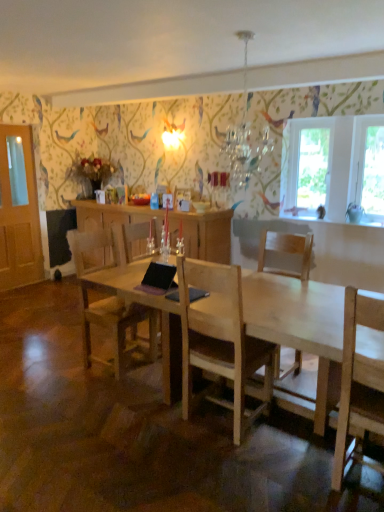
Locate an element on the screen. free point above transparent glass window at right, the second window screen positioned from the left (from a real-world perspective) is located at coordinates (371, 119).